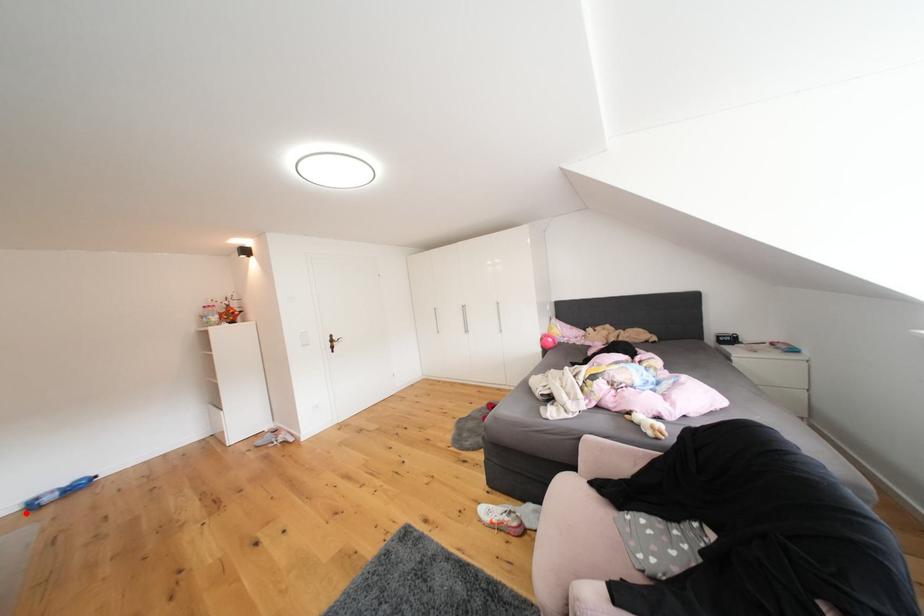
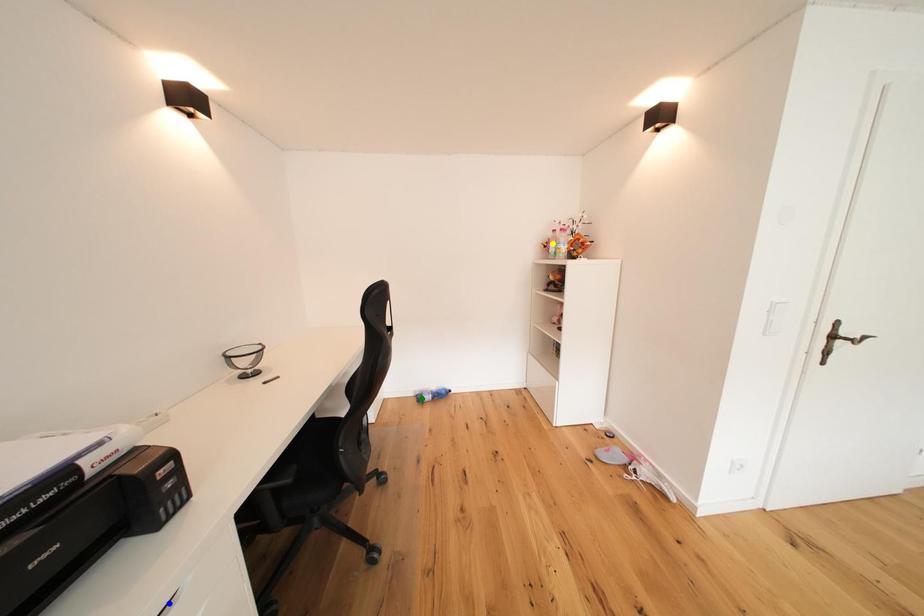
Question: I am providing you with two images of the same scene from different viewpoints. A red point is marked on the first image. You are given multiple points on the second image. Which mark in image 2 goes with the point in image 1?

Choices:
 (A) yellow point
 (B) blue point
 (C) green point

Answer: (C)